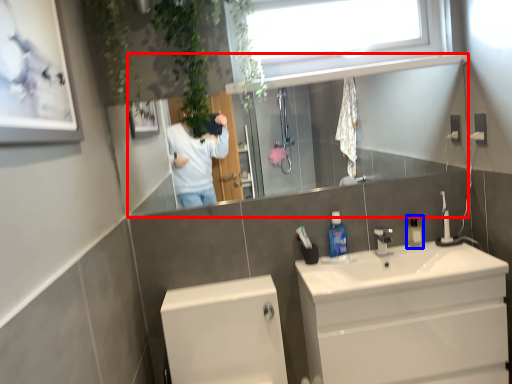
Question: Which object is closer to the camera taking this photo, mirror (highlighted by a red box) or mouthwash (highlighted by a blue box)?

Choices:
 (A) mirror
 (B) mouthwash

Answer: (A)